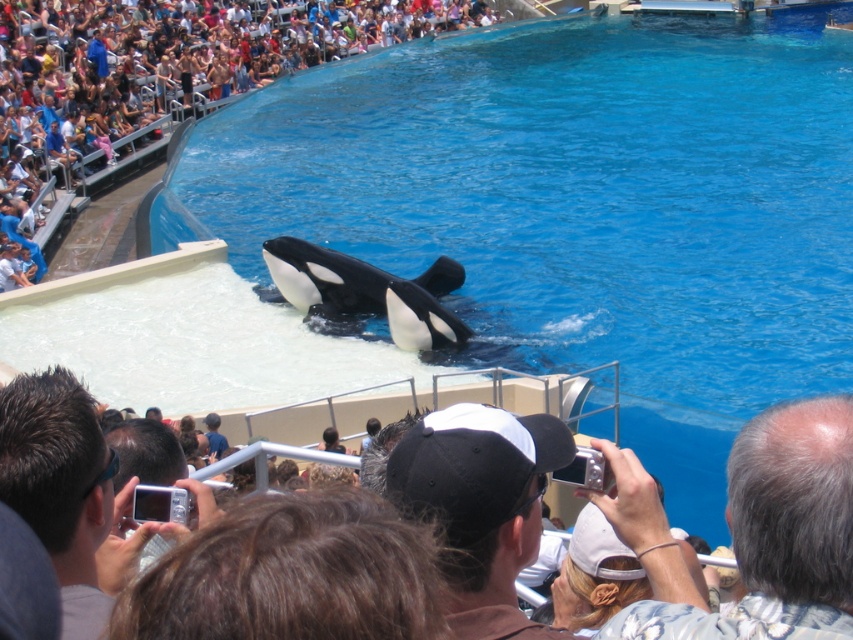
Is smooth skin crowd at upper left to the left of black smooth orca at center from the viewer's perspective?

Correct, you'll find smooth skin crowd at upper left to the left of black smooth orca at center.

Between smooth skin crowd at upper left and black smooth orca at center, which one appears on the right side from the viewer's perspective?

Positioned to the right is black smooth orca at center.

Between point (132, 17) and point (345, 266), which one is positioned behind?

The point (132, 17) is more distant.

Where is `smooth skin crowd at upper left`? smooth skin crowd at upper left is located at coordinates (167, 67).

Does black smooth water at center appear on the left side of smooth skin crowd at upper left?

No, black smooth water at center is not to the left of smooth skin crowd at upper left.

How distant is black smooth water at center from smooth skin crowd at upper left?

black smooth water at center and smooth skin crowd at upper left are 21.53 meters apart from each other.

What do you see at coordinates (578, 205) in the screenshot? I see `black smooth water at center` at bounding box center [578, 205].

Where is `black smooth water at center`? The height and width of the screenshot is (640, 853). black smooth water at center is located at coordinates (578, 205).

Does smooth skin crowd at upper left have a lesser height compared to black matte baseball cap at center?

Incorrect, smooth skin crowd at upper left's height does not fall short of black matte baseball cap at center's.

Between smooth skin crowd at upper left and black matte baseball cap at center, which one appears on the left side from the viewer's perspective?

From the viewer's perspective, smooth skin crowd at upper left appears more on the left side.

What do you see at coordinates (167, 67) in the screenshot? This screenshot has width=853, height=640. I see `smooth skin crowd at upper left` at bounding box center [167, 67].

Find the location of a particular element. This screenshot has height=640, width=853. smooth skin crowd at upper left is located at coordinates (167, 67).